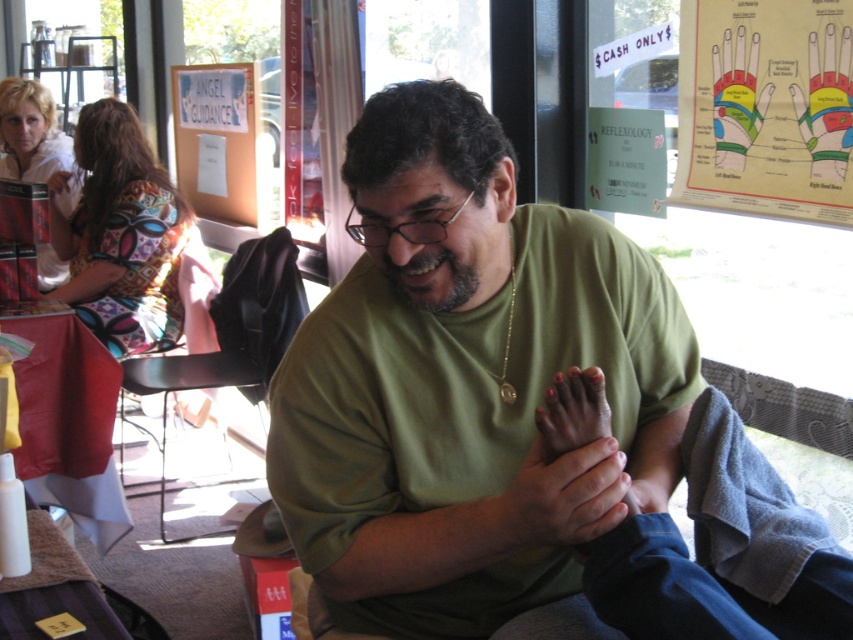
You are a customer in this wellness center and want to know which object is bigger between the green matte shirt at center and the pink matte nail at center. Which one is larger?

The green matte shirt at center is larger in size than the pink matte nail at center.

You are a customer in the wellness center and want to know if the practitioner can comfortably hold your foot during the massage. Based on the image, can the smooth skin hands at center comfortably hold the pink matte nail at center?

The smooth skin hands at center has a larger size compared to pink matte nail at center, so yes, the practitioner can comfortably hold the pink matte nail at center with their smooth skin hands at center.